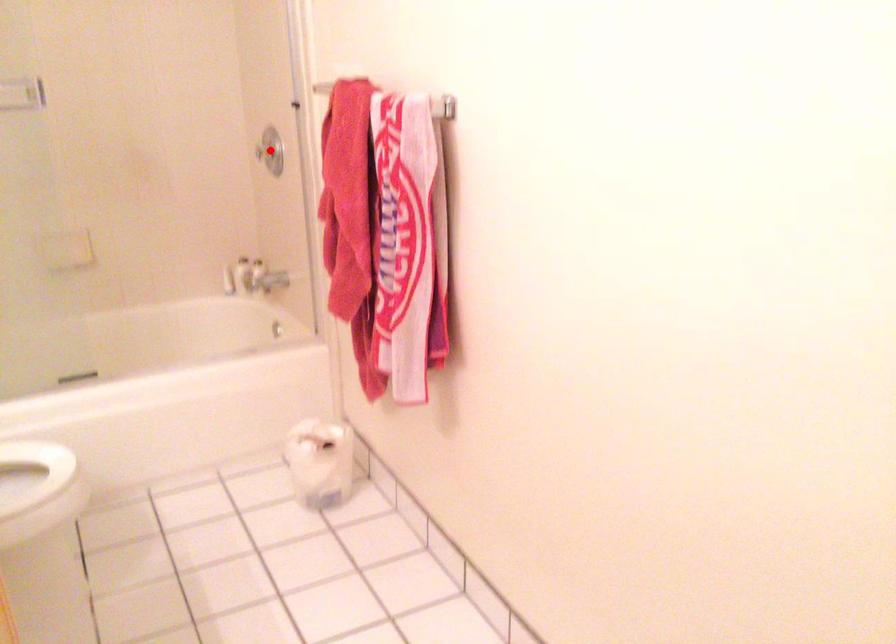
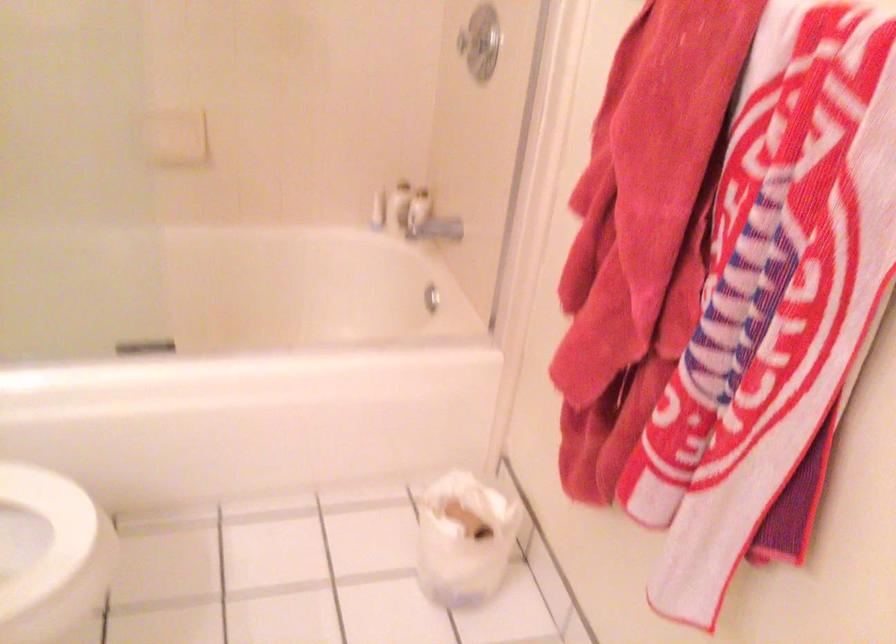
Question: I am providing you with two images of the same scene from different viewpoints. A red point is shown in image1. For the corresponding object point in image2, is it positioned nearer or farther from the camera?

Choices:
 (A) Nearer
 (B) Farther

Answer: (A)